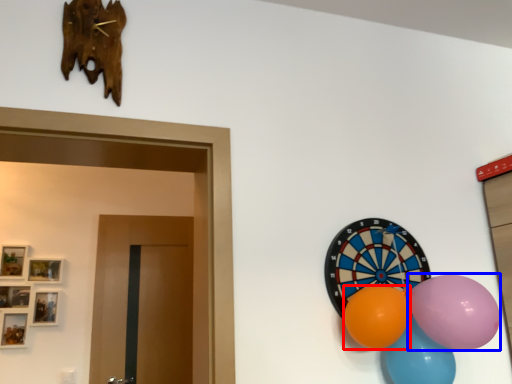
Question: Among these objects, which one is farthest to the camera, balloon (highlighted by a red box) or balloon (highlighted by a blue box)?

Choices:
 (A) balloon
 (B) balloon

Answer: (A)